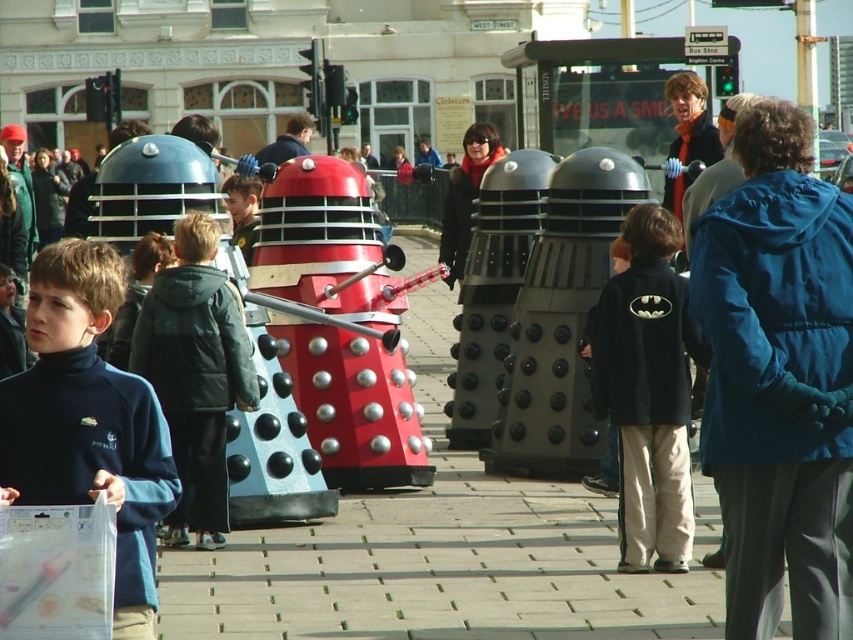
Question: Is blue fleece sweater at lower left wider than green fuzzy jacket at center?

Choices:
 (A) no
 (B) yes

Answer: (B)

Question: Does navy blue fleece jacket at center appear on the right side of green fuzzy jacket at center?

Choices:
 (A) no
 (B) yes

Answer: (B)

Question: Is blue fleece sweater at lower left to the left of navy blue fleece jacket at center from the viewer's perspective?

Choices:
 (A) no
 (B) yes

Answer: (B)

Question: Which point is farther from the camera taking this photo?

Choices:
 (A) (45, 445)
 (B) (204, 321)

Answer: (B)

Question: Which point is farther from the camera taking this photo?

Choices:
 (A) (x=672, y=564)
 (B) (x=158, y=356)
 (C) (x=76, y=372)

Answer: (B)

Question: Which object is farther from the camera taking this photo?

Choices:
 (A) navy blue fleece jacket at center
 (B) green fuzzy jacket at center

Answer: (A)